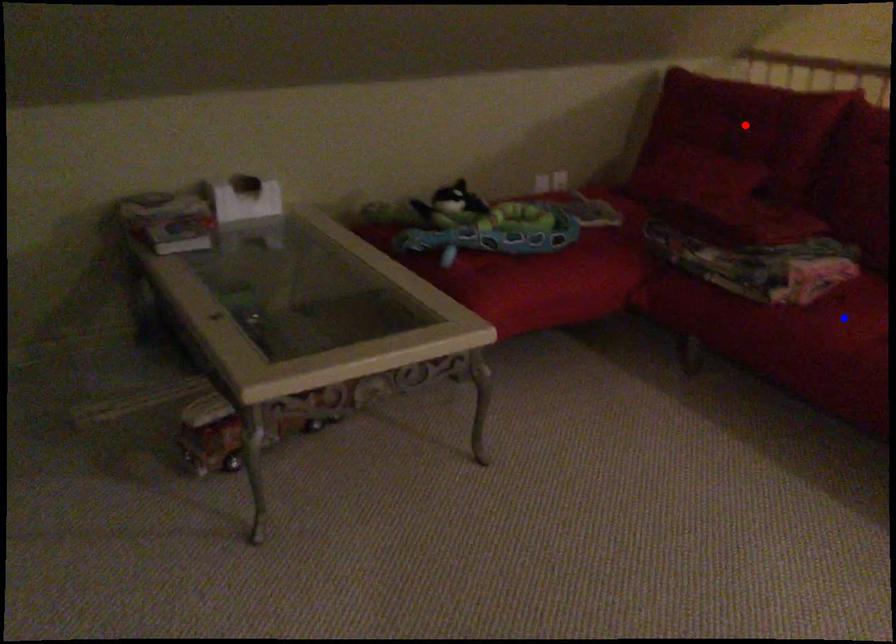
Question: Two points are marked on the image. Which point is closer to the camera?

Choices:
 (A) Blue point is closer.
 (B) Red point is closer.

Answer: (A)